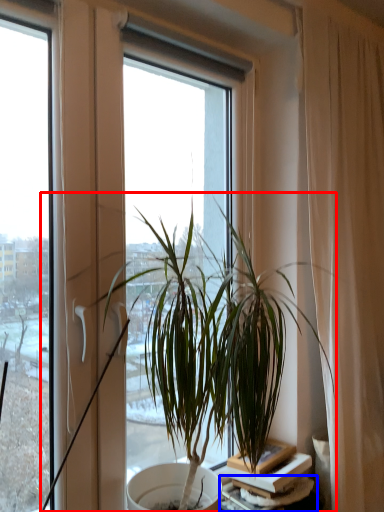
Question: Among these objects, which one is nearest to the camera, houseplant (highlighted by a red box) or table (highlighted by a blue box)?

Choices:
 (A) houseplant
 (B) table

Answer: (A)